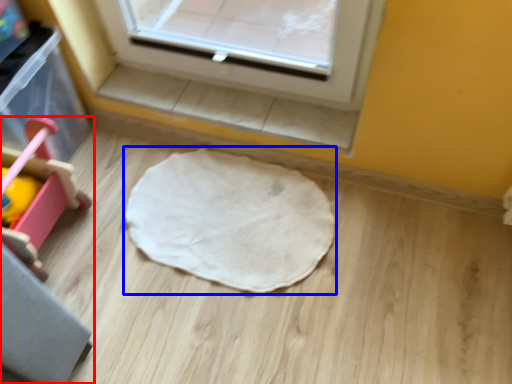
Question: Which point is further to the camera, furniture (highlighted by a red box) or mat (highlighted by a blue box)?

Choices:
 (A) furniture
 (B) mat

Answer: (B)